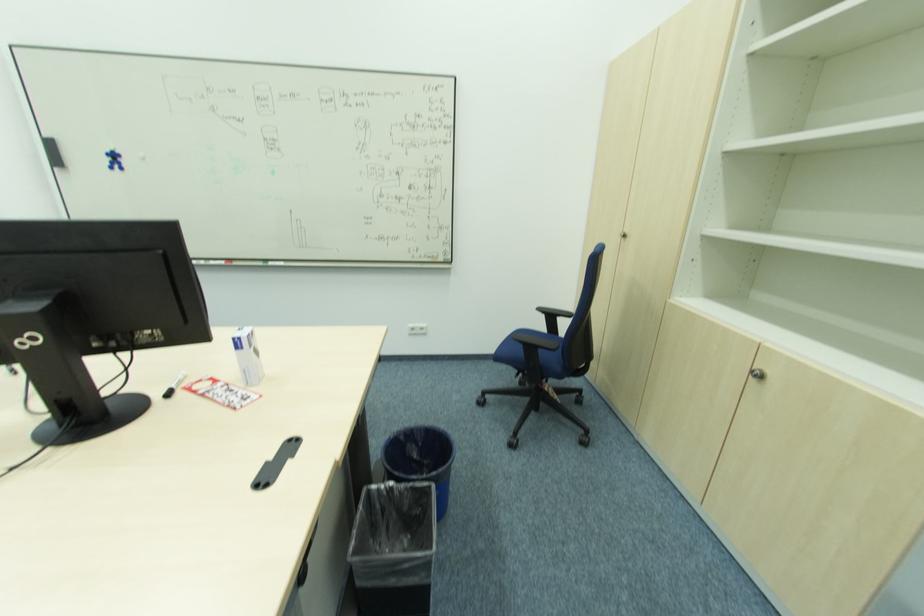
Locate an element on the screen. The height and width of the screenshot is (616, 924). blue trash can is located at coordinates (420, 459).